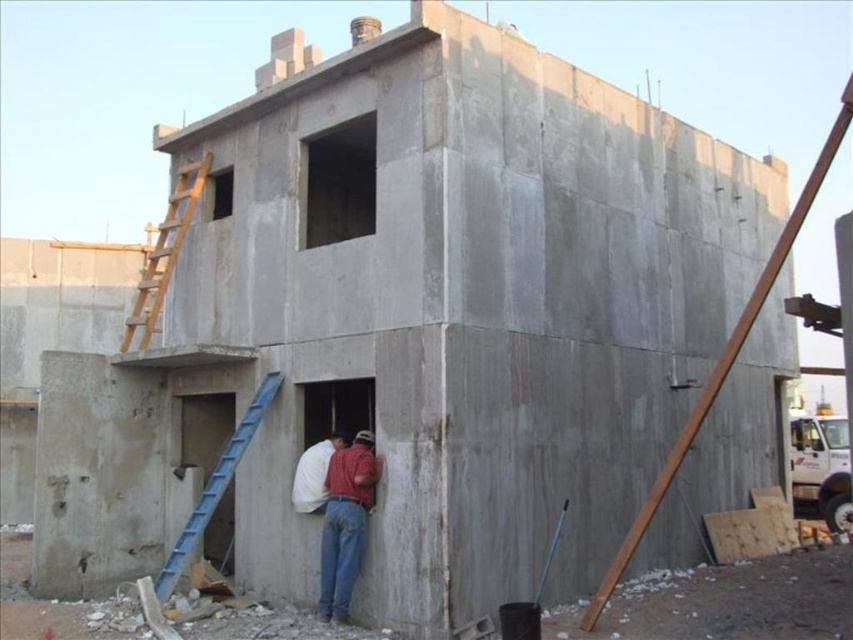
You are a safety inspector checking the construction site. You notice two shirts hanging from the building structure at the center. The red shirt at center and the white matte shirt at center. Which shirt is closer to the blue ladder on the left side?

The red shirt at center is closer to the blue ladder on the left side because they are both at the center and the ladder is on the left side, but the exact distance between the shirts is 47.92 centimeters. However, without knowing their exact positions relative to the ladder, we cannot definitively determine which is closer. Please provide more information about their horizontal positioning.

You are a construction worker needing to reach the second floor of the partially constructed building. You see the wooden ladder at upper left and the blue plastic ladder at lower left. Which ladder is taller and therefore better suited for reaching higher areas?

The wooden ladder at upper left is much taller than the blue plastic ladder at lower left, making it better suited for reaching higher areas like the second floor.

You are standing at the base of the building and see two points marked on the structure. The first point is at coordinate point (350,470) and the second is at point (141,316). Which point is closer to you?

Point (350,470) is in front of point (141,316), so the point closer to you is point (350,470).